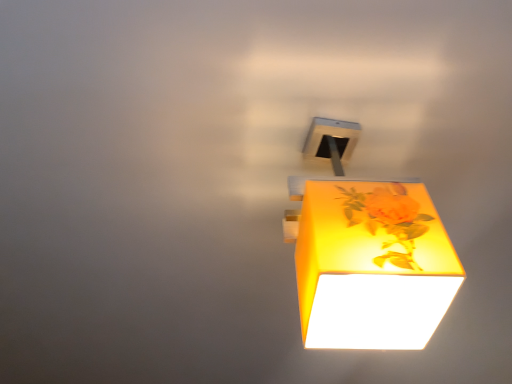
What do you see at coordinates (367, 254) in the screenshot? This screenshot has height=384, width=512. I see `translucent yellow lampshade at upper right` at bounding box center [367, 254].

Identify the location of translucent yellow lampshade at upper right. The width and height of the screenshot is (512, 384). (367, 254).

Looking at this image, measure the distance between point (338,325) and camera.

Point (338,325) and camera are 23.82 inches apart.

I want to click on translucent yellow lampshade at upper right, so click(x=367, y=254).